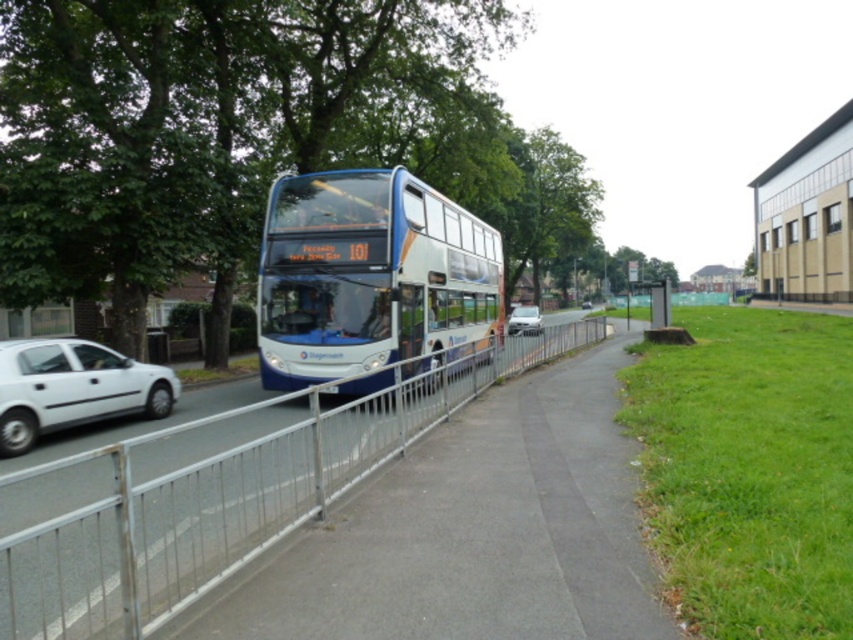
Question: Can you confirm if silver metallic fence at center is wider than white matte car at center?

Choices:
 (A) no
 (B) yes

Answer: (B)

Question: Which point is closer to the camera?

Choices:
 (A) (526, 326)
 (B) (669, 305)
 (C) (265, 269)
 (D) (10, 372)

Answer: (D)

Question: Is the position of metallic silver bus stop at right less distant than that of white matte car at center?

Choices:
 (A) no
 (B) yes

Answer: (A)

Question: Which of the following is the farthest from the observer?

Choices:
 (A) (355, 416)
 (B) (120, 396)
 (C) (535, 314)

Answer: (C)

Question: Does white matte car at left appear on the right side of metallic silver bus stop at right?

Choices:
 (A) yes
 (B) no

Answer: (B)

Question: Which is farther from the metallic silver bus stop at right?

Choices:
 (A) silver metallic fence at center
 (B) blue metallic bus at center

Answer: (A)